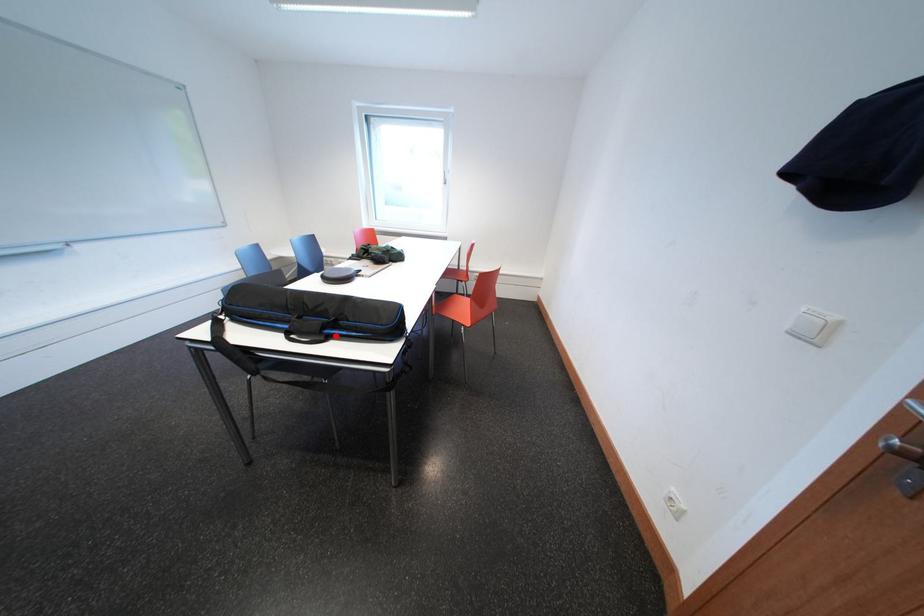
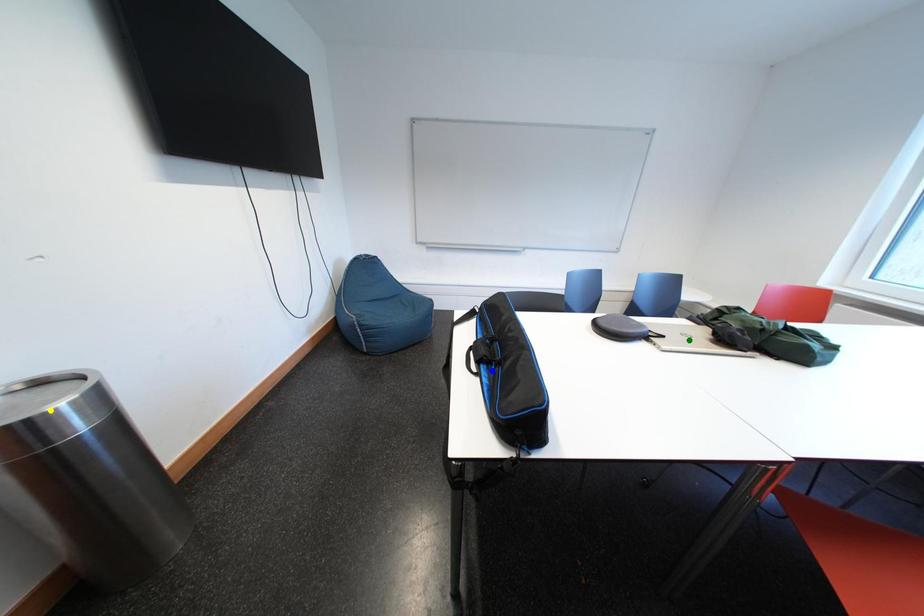
Question: I am providing you with two images of the same scene from different viewpoints. A red point is marked on the first image. You are given multiple points on the second image. Which spot in image 2 lines up with the point in image 1?

Choices:
 (A) blue point
 (B) yellow point
 (C) green point

Answer: (A)